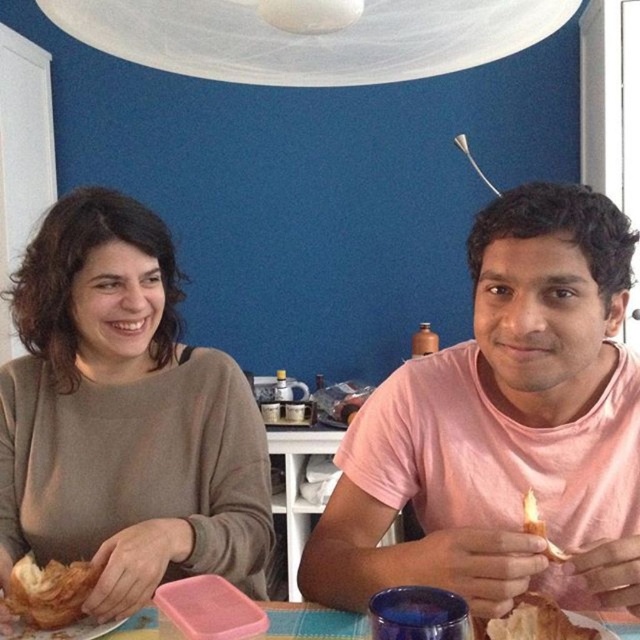
You are a photographer setting up a shoot at this table. You want to place a small prop between the matte brown sweater at left and the golden crispy bread at right. Based on their current positions, where should you place the prop so it doesn

The matte brown sweater at left is positioned over the golden crispy bread at right, so placing the prop between them would require positioning it below the sweater and above the bread to ensure it is visible between the two objects.

Please look at the table with the blue, green, and yellow tablecloth. There is a pink rectangular container, a blue glass, and a golden crispy croissant at lower right. Which object is located at the coordinate point [536,621]?

The golden crispy croissant at lower right is located at coordinate point [536,621].

You are a food critic who needs to choose between the golden crispy croissant at lower right and the golden crispy bread at right for your review. Based on their sizes, which one would you recommend for a larger portion?

The golden crispy croissant at lower right has a larger width than the golden crispy bread at right, so it would be the better choice for a larger portion.